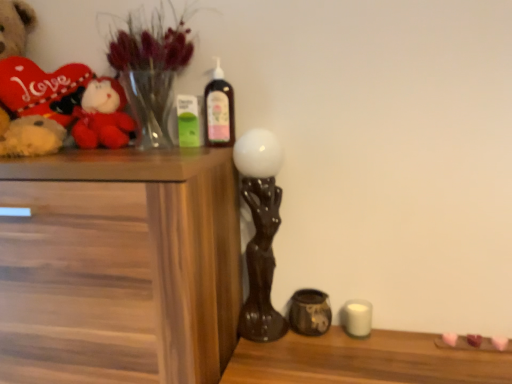
What do you see at coordinates (102, 116) in the screenshot? I see `velvet plush toy at left` at bounding box center [102, 116].

The height and width of the screenshot is (384, 512). Identify the location of matte brown ceramic jar at lower center, marked as the 2th candle holder in a left-to-right arrangement. 310,312.

From the picture: Measure the distance between wooden chest of drawers at left and camera.

The depth of wooden chest of drawers at left is 79.75 centimeters.

I want to click on translucent glass vase at upper left, so click(x=151, y=69).

This screenshot has height=384, width=512. Describe the element at coordinates (219, 110) in the screenshot. I see `translucent plastic bottle at upper center` at that location.

Describe the element at coordinates (358, 318) in the screenshot. I see `white matte candle at lower right` at that location.

The height and width of the screenshot is (384, 512). I want to click on velvet plush toy at left, so pos(102,116).

Does wooden chest of drawers at left appear on the right side of velvet plush toy at left?

Incorrect, wooden chest of drawers at left is not on the right side of velvet plush toy at left.

Is wooden chest of drawers at left with velvet plush toy at left?

They are not placed beside each other.

In the scene shown: Looking at their sizes, would you say wooden chest of drawers at left is wider or thinner than velvet plush toy at left?

Considering their sizes, wooden chest of drawers at left looks broader than velvet plush toy at left.

Could you tell me if wooden chest of drawers at left is turned towards velvet plush toy at left?

No, wooden chest of drawers at left is not turned towards velvet plush toy at left.

From a real-world perspective, who is located higher, matte black sculpture at center, placed as the 1th candle holder when sorted from left to right, or matte brown ceramic jar at lower center, marked as the 2th candle holder in a left-to-right arrangement?

In real-world perspective, matte black sculpture at center, placed as the 1th candle holder when sorted from left to right, is above.

Is matte black sculpture at center, the second candle holder from the right, facing away from matte brown ceramic jar at lower center, the 1th candle holder from the right?

No, matte black sculpture at center, the second candle holder from the right, is not facing the opposite direction of matte brown ceramic jar at lower center, the 1th candle holder from the right.

Which is closer, [278,145] or [291,316]?

The point [278,145] is in front.

Which object is wider, matte black sculpture at center, the second candle holder from the right, or matte brown ceramic jar at lower center, the 1th candle holder from the right?

Wider between the two is matte black sculpture at center, the second candle holder from the right.

How many degrees apart are the facing directions of translucent plastic bottle at upper center and translucent glass vase at upper left?

2.61 degrees separate the facing orientations of translucent plastic bottle at upper center and translucent glass vase at upper left.

Is translucent plastic bottle at upper center closer to camera compared to translucent glass vase at upper left?

No, translucent plastic bottle at upper center is behind translucent glass vase at upper left.

From the picture: From a real-world perspective, is translucent plastic bottle at upper center below translucent glass vase at upper left?

Yes, from a real-world perspective, translucent plastic bottle at upper center is under translucent glass vase at upper left.

From the picture: Is translucent plastic bottle at upper center directly adjacent to translucent glass vase at upper left?

There is a gap between translucent plastic bottle at upper center and translucent glass vase at upper left.

From their relative heights in the image, would you say matte black sculpture at center, placed as the 1th candle holder when sorted from left to right, is taller or shorter than velvet plush toy at left?

Considering their sizes, matte black sculpture at center, placed as the 1th candle holder when sorted from left to right, has more height than velvet plush toy at left.

Where is `the 1st candle holder counting from the right of the velvet plush toy at left`? The image size is (512, 384). the 1st candle holder counting from the right of the velvet plush toy at left is located at coordinates (260, 231).

How many degrees apart are the facing directions of matte black sculpture at center, the second candle holder from the right, and velvet plush toy at left?

4.22 degrees separate the facing orientations of matte black sculpture at center, the second candle holder from the right, and velvet plush toy at left.

Considering the sizes of objects matte black sculpture at center, the second candle holder from the right, and velvet plush toy at left in the image provided, who is smaller, matte black sculpture at center, the second candle holder from the right, or velvet plush toy at left?

velvet plush toy at left.

In the scene shown: From the image's perspective, is matte brown ceramic jar at lower center, the 1th candle holder from the right, located above or below translucent plastic bottle at upper center?

Based on their image positions, matte brown ceramic jar at lower center, the 1th candle holder from the right, is located beneath translucent plastic bottle at upper center.

Identify the location of candle holder behind the translucent plastic bottle at upper center. This screenshot has height=384, width=512. (310, 312).

Is matte brown ceramic jar at lower center, the 1th candle holder from the right, not within translucent plastic bottle at upper center?

Absolutely, matte brown ceramic jar at lower center, the 1th candle holder from the right, is external to translucent plastic bottle at upper center.

How many degrees apart are the facing directions of matte brown ceramic jar at lower center, the 1th candle holder from the right, and translucent plastic bottle at upper center?

The facing directions of matte brown ceramic jar at lower center, the 1th candle holder from the right, and translucent plastic bottle at upper center are 0.39 degrees apart.

Measure the distance from velvet plush toy at left to matte black sculpture at center, placed as the 1th candle holder when sorted from left to right.

velvet plush toy at left is 16.48 inches away from matte black sculpture at center, placed as the 1th candle holder when sorted from left to right.

Which object is further away from the camera taking this photo, velvet plush toy at left or matte black sculpture at center, placed as the 1th candle holder when sorted from left to right?

velvet plush toy at left.

From their relative heights in the image, would you say velvet plush toy at left is taller or shorter than matte black sculpture at center, placed as the 1th candle holder when sorted from left to right?

In the image, velvet plush toy at left appears to be shorter than matte black sculpture at center, placed as the 1th candle holder when sorted from left to right.

Is point (121, 104) closer to viewer compared to point (270, 273)?

No, it is not.

Where is `candle directly beneath the translucent plastic bottle at upper center (from a real-world perspective)`? The height and width of the screenshot is (384, 512). candle directly beneath the translucent plastic bottle at upper center (from a real-world perspective) is located at coordinates (358, 318).

From the image's perspective, which one is positioned lower, white matte candle at lower right or translucent plastic bottle at upper center?

From the image's view, white matte candle at lower right is below.

Does white matte candle at lower right lie in front of translucent plastic bottle at upper center?

No, white matte candle at lower right is further to the viewer.

Locate an element on the screen. This screenshot has height=384, width=512. toy behind the wooden chest of drawers at left is located at coordinates (102, 116).

Identify the location of candle holder lying above the matte brown ceramic jar at lower center, marked as the 2th candle holder in a left-to-right arrangement (from the image's perspective). The width and height of the screenshot is (512, 384). (260, 231).

Estimate the real-world distances between objects in this image. Which object is closer to matte brown ceramic jar at lower center, the 1th candle holder from the right, velvet plush toy at left or translucent glass vase at upper left?

The object closer to matte brown ceramic jar at lower center, the 1th candle holder from the right, is velvet plush toy at left.

Looking at this image, based on their spatial positions, is translucent glass vase at upper left or velvet plush toy at left closer to matte brown ceramic jar at lower center, marked as the 2th candle holder in a left-to-right arrangement?

The object closer to matte brown ceramic jar at lower center, marked as the 2th candle holder in a left-to-right arrangement, is velvet plush toy at left.

Considering their positions, is white matte candle at lower right positioned closer to velvet plush toy at left than matte black sculpture at center, placed as the 1th candle holder when sorted from left to right?

Based on the image, matte black sculpture at center, placed as the 1th candle holder when sorted from left to right, appears to be nearer to velvet plush toy at left.

From the image, which object appears to be nearer to translucent glass vase at upper left, matte brown ceramic jar at lower center, marked as the 2th candle holder in a left-to-right arrangement, or wooden chest of drawers at left?

wooden chest of drawers at left.

Looking at the image, which one is located further to velvet plush toy at left, translucent glass vase at upper left or translucent plastic bottle at upper center?

Among the two, translucent plastic bottle at upper center is located further to velvet plush toy at left.

When comparing their distances from white matte candle at lower right, does wooden chest of drawers at left or matte brown ceramic jar at lower center, marked as the 2th candle holder in a left-to-right arrangement, seem further?

wooden chest of drawers at left is further to white matte candle at lower right.

From the picture: Estimate the real-world distances between objects in this image. Which object is closer to translucent glass vase at upper left, matte black sculpture at center, the second candle holder from the right, or matte brown ceramic jar at lower center, marked as the 2th candle holder in a left-to-right arrangement?

The object closer to translucent glass vase at upper left is matte black sculpture at center, the second candle holder from the right.

Estimate the real-world distances between objects in this image. Which object is closer to velvet plush toy at left, translucent glass vase at upper left or matte brown ceramic jar at lower center, the 1th candle holder from the right?

translucent glass vase at upper left lies closer to velvet plush toy at left than the other object.

The width and height of the screenshot is (512, 384). What are the coordinates of `floral arrangement between wooden chest of drawers at left and white matte candle at lower right from left to right` in the screenshot? It's located at point(151,69).

Image resolution: width=512 pixels, height=384 pixels. What are the coordinates of `bottle between wooden chest of drawers at left and white matte candle at lower right` in the screenshot? It's located at (219, 110).

You are a GUI agent. You are given a task and a screenshot of the screen. Output one action in this format:
    pyautogui.click(x=<x>, y=<y>)
    Task: Click on the candle holder between velvet plush toy at left and matte brown ceramic jar at lower center, marked as the 2th candle holder in a left-to-right arrangement, in the horizontal direction
    This screenshot has height=384, width=512.
    Given the screenshot: What is the action you would take?
    coord(260,231)

Locate an element on the screen. This screenshot has width=512, height=384. toy between translucent plastic bottle at upper center and wooden chest of drawers at left from top to bottom is located at coordinates (102, 116).